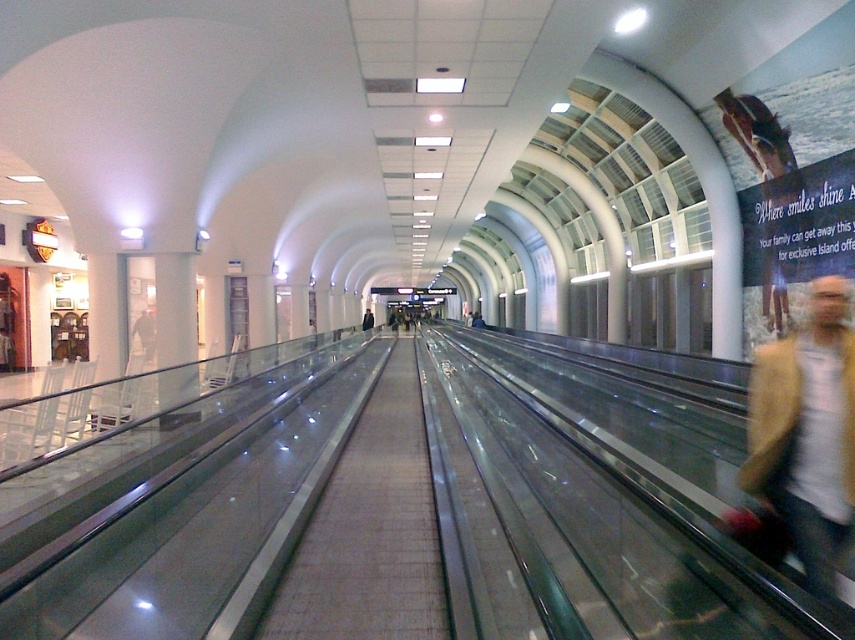
You are standing in the airport corridor and see both the light brown leather jacket at lower right and the dark blue jacket at center. Which jacket is positioned closer to the moving walkway?

The dark blue jacket at center is closer to the moving walkway because the light brown leather jacket at lower right is to the right of it, meaning the dark blue jacket is between the moving walkway and the light brown leather jacket.

You are standing at the point marked as point [793,362] in the corridor. You need to reach the security checkpoint located at the other end of the corridor. The moving walkway is 10 feet wide. Can you step onto the moving walkway from your current position to reach the checkpoint faster?

The distance between you and the security checkpoint is 10.27 feet. Since the moving walkway is 10 feet wide, stepping onto it from your current position at point [793,362] would require moving within the walkway area. However, the walkway is only 10 feet wide, and your position is slightly beyond this width, making it impossible to step onto the walkway directly. You should move laterally to align with the walkway first.

You are standing in the corridor and want to pick up both jackets. Which jacket should you reach for first, the light brown leather jacket at lower right or the dark blue jacket at center?

The light brown leather jacket at lower right is closer to you, so you should reach for it first.